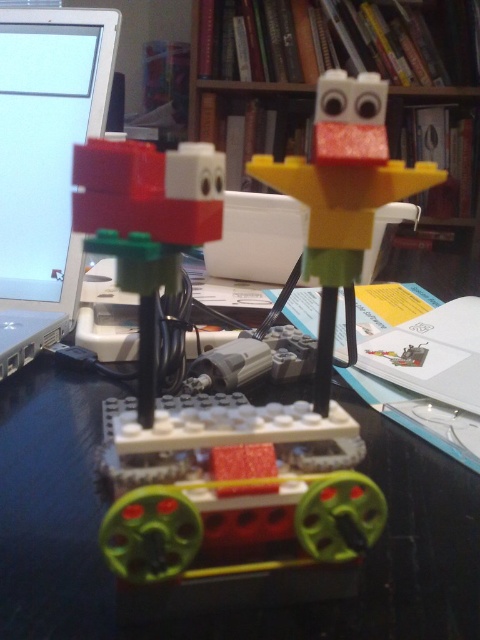
Question: Is green plastic table at center positioned behind yellow matte plastic bird at upper center?

Choices:
 (A) yes
 (B) no

Answer: (A)

Question: Can you confirm if matte silver laptop at left is wider than yellow matte plastic bird at upper center?

Choices:
 (A) no
 (B) yes

Answer: (B)

Question: Among these points, which one is farthest from the camera?

Choices:
 (A) (379, 26)
 (B) (20, 236)
 (C) (337, 88)
 (D) (147, 360)

Answer: (A)

Question: Which of the following is the farthest from the observer?

Choices:
 (A) matte silver laptop at left
 (B) green plastic table at center

Answer: (A)

Question: Among these points, which one is farthest from the camera?

Choices:
 (A) (120, 180)
 (B) (244, 81)
 (C) (63, 243)

Answer: (B)

Question: Is green plastic table at center below brick red plastic block at center?

Choices:
 (A) no
 (B) yes

Answer: (B)